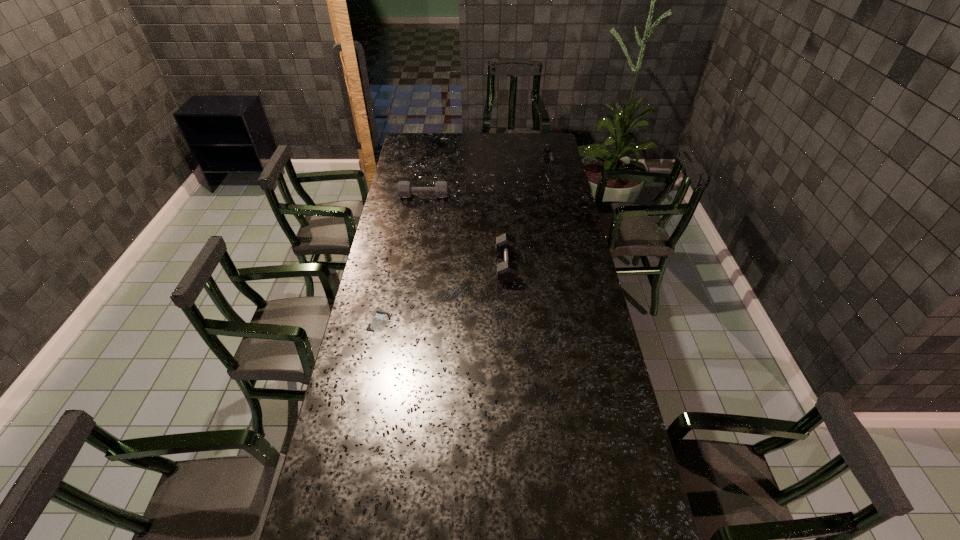
Locate an element on the screen. This screenshot has width=960, height=540. the farthest object is located at coordinates (554, 170).

This screenshot has width=960, height=540. Find the location of `the farthest dumbbell`. the farthest dumbbell is located at coordinates (554, 170).

Locate an element on the screen. This screenshot has height=540, width=960. the second dumbbell from right to left is located at coordinates (507, 271).

I want to click on the second object from right to left, so click(507, 271).

Find the location of a particular element. The image size is (960, 540). the second nearest dumbbell is located at coordinates (405, 190).

Where is `the leftmost dumbbell`? the leftmost dumbbell is located at coordinates (405, 190).

You are a GUI agent. You are given a task and a screenshot of the screen. Output one action in this format:
    pyautogui.click(x=<x>, y=<y>)
    Task: Click on the shortest object
    This screenshot has height=540, width=960.
    Given the screenshot: What is the action you would take?
    pyautogui.click(x=380, y=319)

Image resolution: width=960 pixels, height=540 pixels. I want to click on identity card, so click(x=380, y=319).

Locate an element on the screen. This screenshot has width=960, height=540. vacant space located 0.170m on the front of the farthest dumbbell is located at coordinates (559, 202).

Where is `free space located 0.060m on the front of the second dumbbell from right to left`? The height and width of the screenshot is (540, 960). free space located 0.060m on the front of the second dumbbell from right to left is located at coordinates (508, 297).